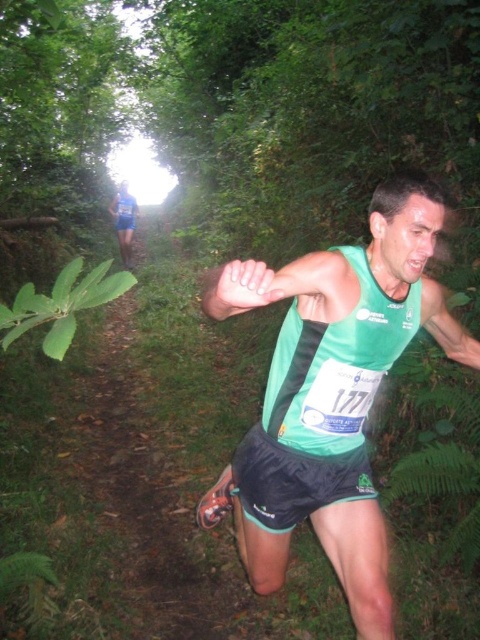
Question: Is green fabric tank top at center positioned behind blue fabric runner at upper center?

Choices:
 (A) no
 (B) yes

Answer: (A)

Question: Among these points, which one is nearest to the camera?

Choices:
 (A) (388, 200)
 (B) (232, 480)
 (C) (126, 250)

Answer: (A)

Question: Can you confirm if green fabric tank top at center is positioned below blue fabric runner at upper center?

Choices:
 (A) yes
 (B) no

Answer: (A)

Question: Which point is closer to the camera?

Choices:
 (A) green fabric tank top at center
 (B) blue fabric runner at upper center
 (C) black synthetic shorts at center

Answer: (A)

Question: Does green fabric tank top at center appear on the left side of black synthetic shorts at center?

Choices:
 (A) no
 (B) yes

Answer: (A)

Question: Which point appears closest to the camera in this image?

Choices:
 (A) (288, 502)
 (B) (360, 592)
 (C) (123, 236)

Answer: (B)